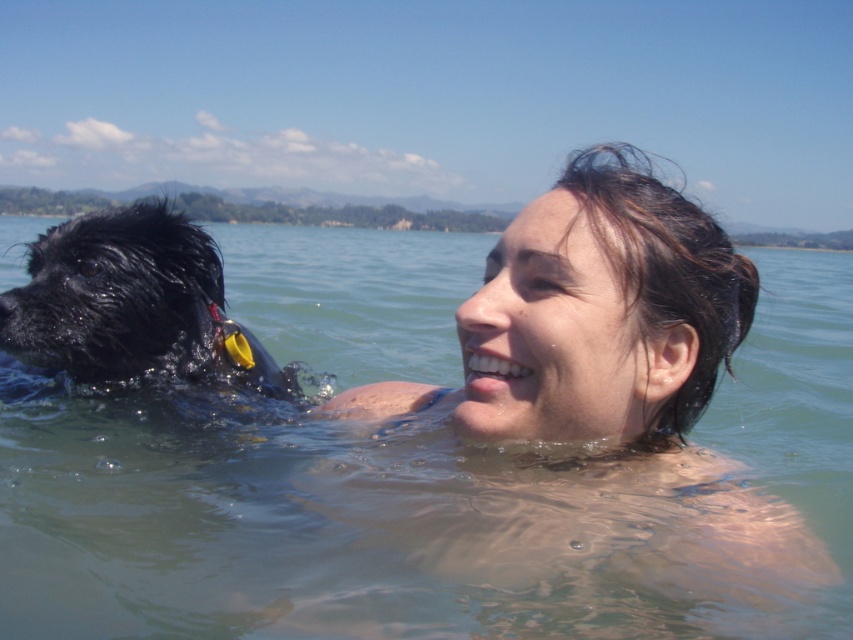
Where is `clear water at upper center`? This screenshot has width=853, height=640. clear water at upper center is located at coordinates (440, 513).

Measure the distance between point [410,232] and camera.

Point [410,232] is 58.74 feet away from camera.

Which is in front, point (462, 584) or point (271, 364)?

Point (462, 584) is in front.

Identify the location of clear water at upper center. (440, 513).